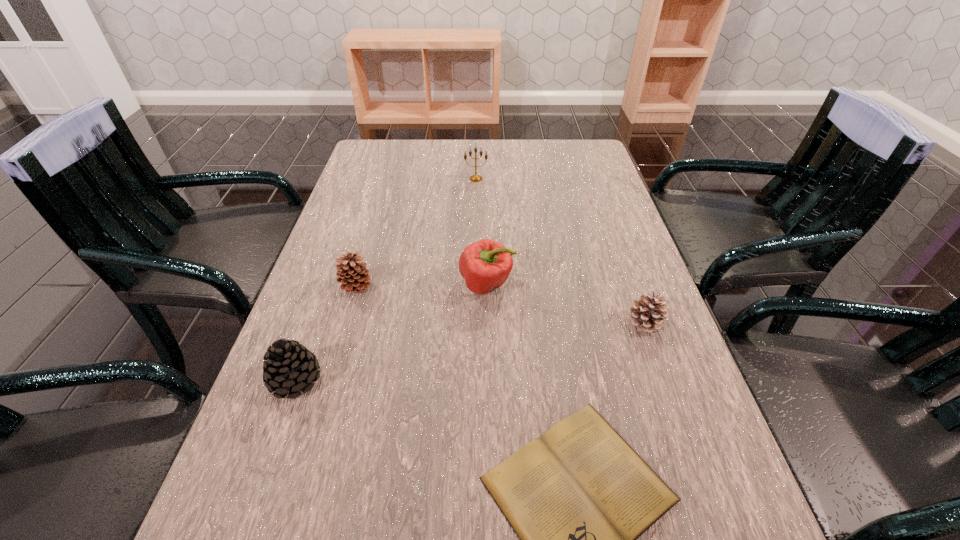
Where is `free space located 0.090m on the front of the third nearest object`? free space located 0.090m on the front of the third nearest object is located at coordinates (663, 374).

You are a GUI agent. You are given a task and a screenshot of the screen. Output one action in this format:
    pyautogui.click(x=<x>, y=<y>)
    Task: Click on the object that is at the far edge
    The width and height of the screenshot is (960, 540).
    Given the screenshot: What is the action you would take?
    pyautogui.click(x=474, y=178)

At what (x,y) coordinates should I click in order to perform the action: click on object that is at the right edge. Please return your answer as a coordinate pair (x, y). The height and width of the screenshot is (540, 960). Looking at the image, I should click on (647, 313).

Where is `vacant space at the far edge`? The width and height of the screenshot is (960, 540). vacant space at the far edge is located at coordinates (520, 145).

Locate an element on the screen. The height and width of the screenshot is (540, 960). free space at the left edge of the desktop is located at coordinates (372, 226).

Locate an element on the screen. The image size is (960, 540). free space at the right edge of the desktop is located at coordinates (661, 346).

You are a GUI agent. You are given a task and a screenshot of the screen. Output one action in this format:
    pyautogui.click(x=<x>, y=<y>)
    Task: Click on the vacant space at the far right corner of the desktop
    
    Given the screenshot: What is the action you would take?
    pyautogui.click(x=598, y=160)

This screenshot has height=540, width=960. Find the location of `empty space between the candelabrum and the bell pepper`. empty space between the candelabrum and the bell pepper is located at coordinates (481, 232).

Image resolution: width=960 pixels, height=540 pixels. Find the location of `free space between the bell pepper and the farthest pinecone`. free space between the bell pepper and the farthest pinecone is located at coordinates (421, 286).

At what (x,y) coordinates should I click in order to perform the action: click on free space between the farthest pinecone and the rightmost object. Please return your answer as a coordinate pair (x, y). This screenshot has width=960, height=540. Looking at the image, I should click on (501, 305).